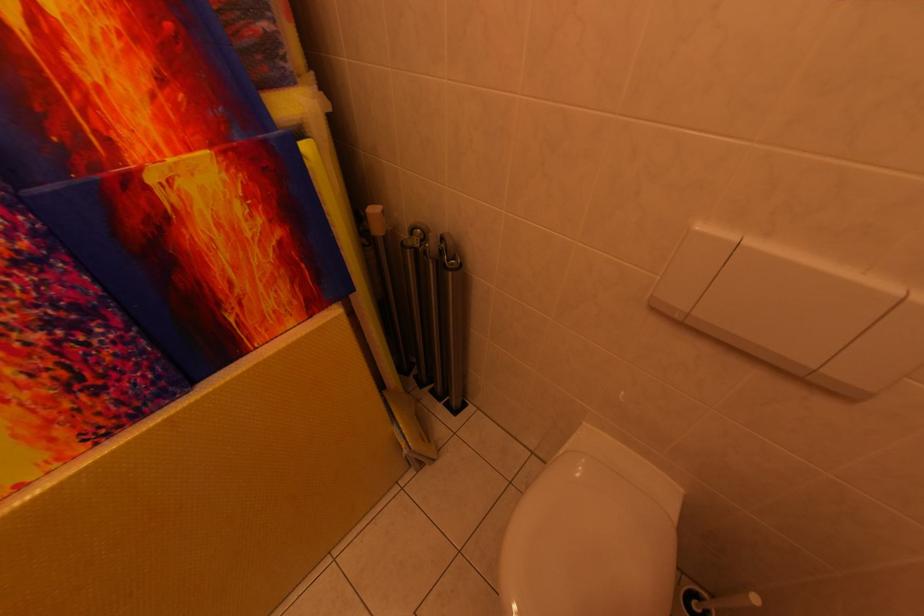
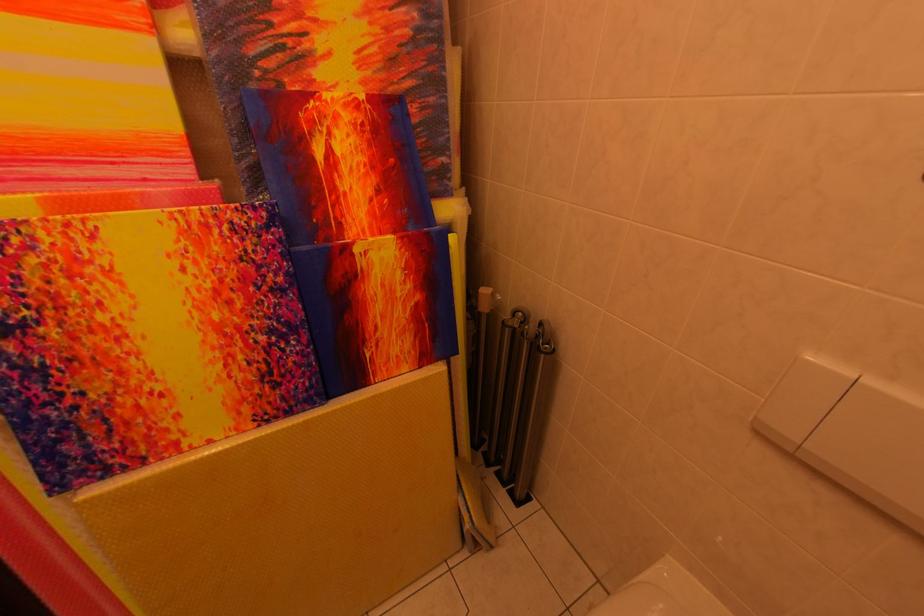
Question: The camera is either moving clockwise (left) or counter-clockwise (right) around the object. The first image is from the beginning of the video and the second image is from the end. Is the camera moving left or right when shooting the video?

Choices:
 (A) Left
 (B) Right

Answer: (B)